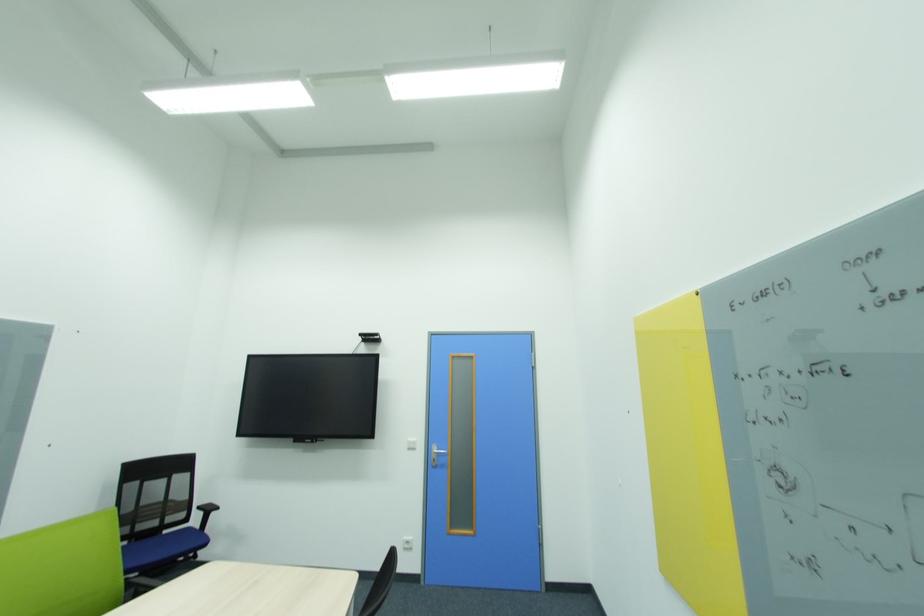
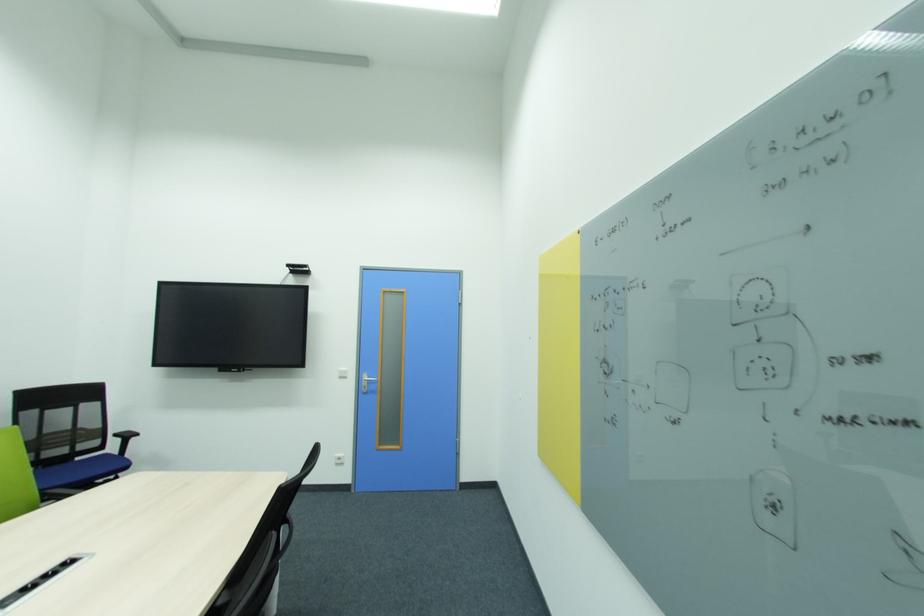
Find the pixel in the second image that matches [782,469] in the first image.

(610, 362)